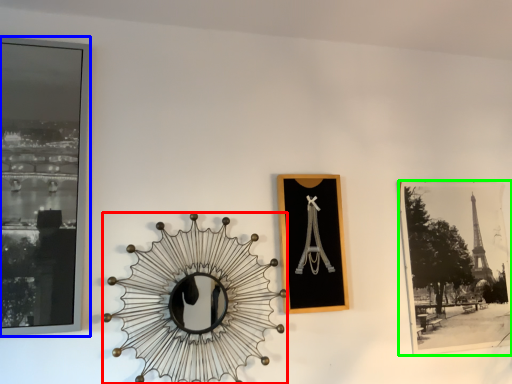
Question: Estimate the real-world distances between objects in this image. Which object is farther from design (highlighted by a red box), picture frame (highlighted by a blue box) or picture frame (highlighted by a green box)?

Choices:
 (A) picture frame
 (B) picture frame

Answer: (B)